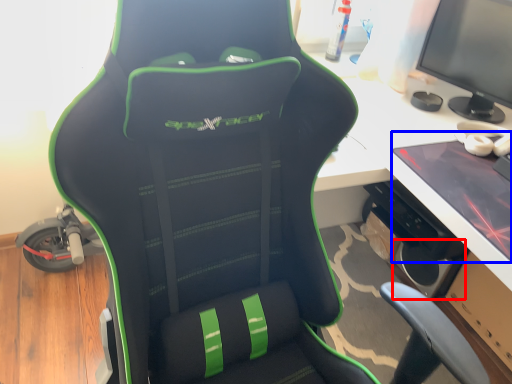
Question: Which object appears closest to the camera in this image, speaker (highlighted by a red box) or laptop (highlighted by a blue box)?

Choices:
 (A) speaker
 (B) laptop

Answer: (B)